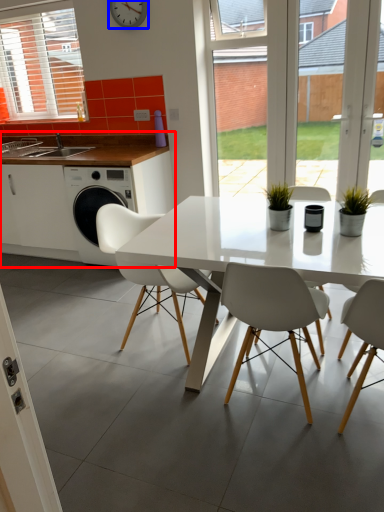
Question: Which point is closer to the camera, cabinetry (highlighted by a red box) or clock (highlighted by a blue box)?

Choices:
 (A) cabinetry
 (B) clock

Answer: (B)